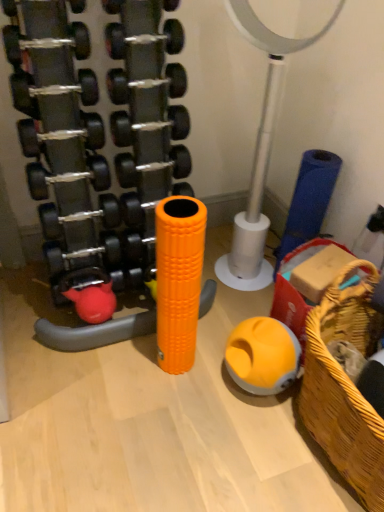
Locate an element on the screen. vacant region in front of orange foam roller at center, marked as the first toy in a left-to-right arrangement is located at coordinates (180, 397).